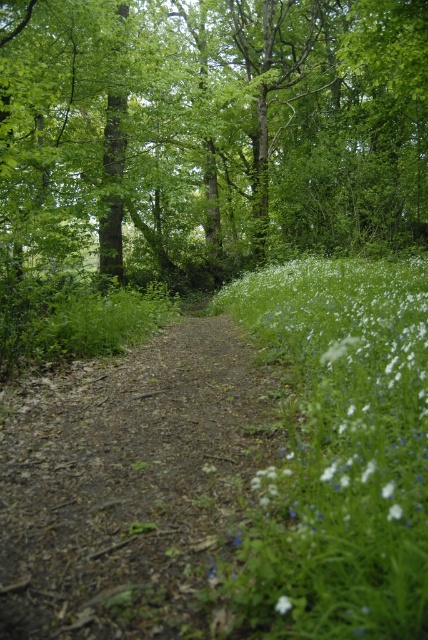
You are a hiker walking along the forest path and want to reach a specific destination. You notice two points marked on your map corresponding to coordinates point (216, 540) and point (386, 339). According to the image, which point is closer to your current position on the path?

Point (216, 540) is in front of point (386, 339), so the point closer to your current position on the path is point (216, 540).

You are a hiker walking along the dirt path at center in the forest. You want to take a photo of the green leafy tree at center from the left side of the path. Is the tree positioned in a way that allows you to do this?

The green leafy tree at center is to the right of the dirt path at center, so you can take a photo of the green leafy tree at center from the left side of the path as it is positioned to the right of the path.